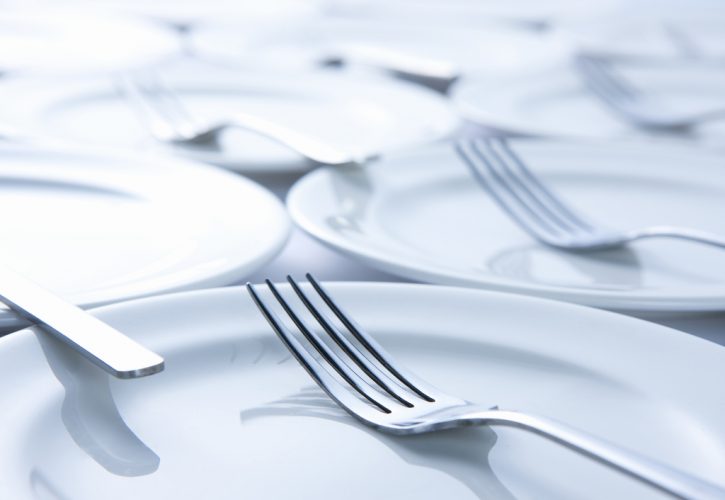
Where is `plate`? This screenshot has height=500, width=725. plate is located at coordinates (x=241, y=393), (x=418, y=220), (x=130, y=249), (x=365, y=115), (x=544, y=116), (x=439, y=61), (x=70, y=60), (x=623, y=31).